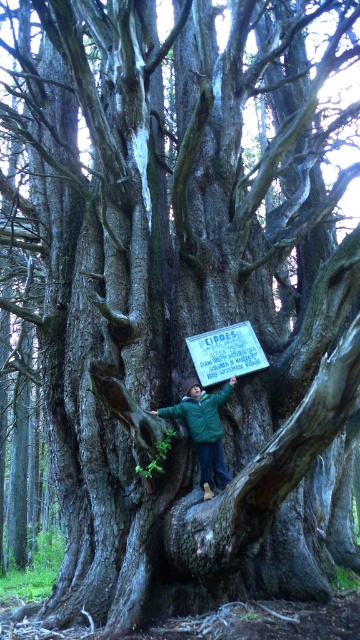
Question: Which of the following is the farthest from the observer?

Choices:
 (A) green matte jacket at center
 (B) wooden sign at center

Answer: (B)

Question: Can you confirm if green matte jacket at center is positioned above wooden sign at center?

Choices:
 (A) no
 (B) yes

Answer: (A)

Question: Can you confirm if green matte jacket at center is positioned above wooden sign at center?

Choices:
 (A) no
 (B) yes

Answer: (A)

Question: Is green matte jacket at center below wooden sign at center?

Choices:
 (A) yes
 (B) no

Answer: (A)